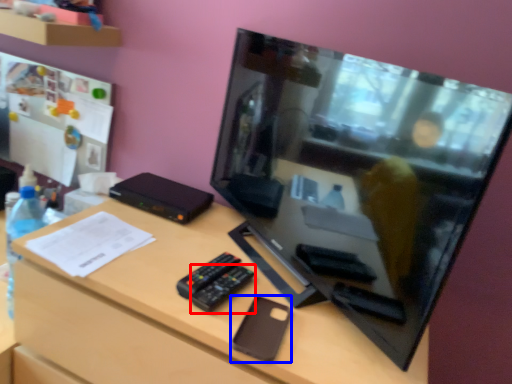
Question: Which object is closer to the camera taking this photo, control (highlighted by a red box) or gadget (highlighted by a blue box)?

Choices:
 (A) control
 (B) gadget

Answer: (B)